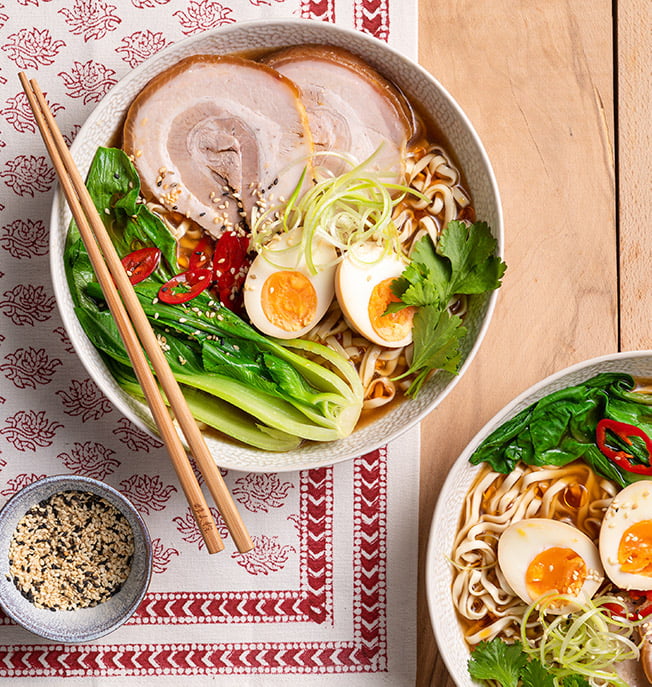
Find the location of a particular element. The width and height of the screenshot is (652, 687). wooden table is located at coordinates (525, 371).